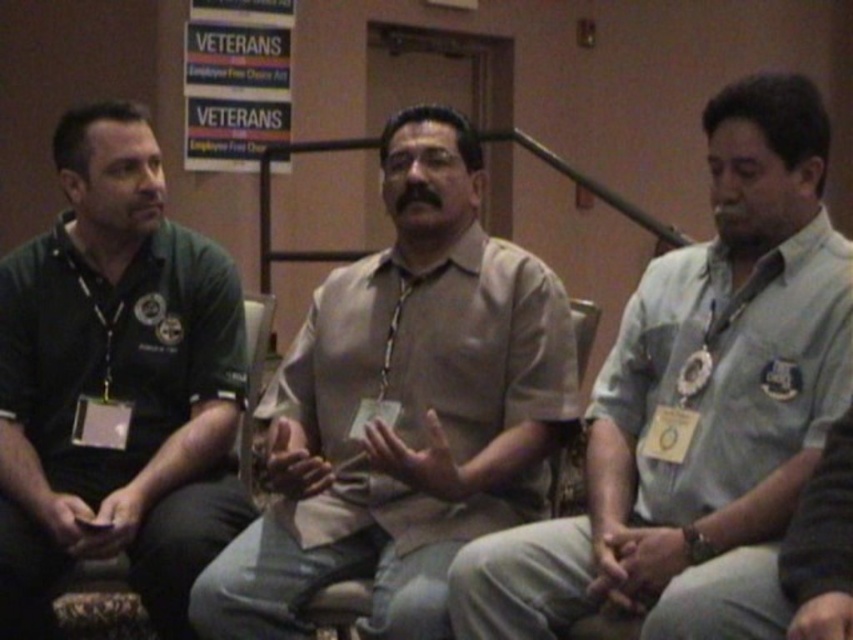
Which is above, dark green polo shirt at left or wooden chair at center?

Positioned higher is dark green polo shirt at left.

Which is more to the right, dark green polo shirt at left or wooden chair at center?

From the viewer's perspective, wooden chair at center appears more on the right side.

This screenshot has width=853, height=640. In order to click on dark green polo shirt at left in this screenshot , I will do `click(115, 381)`.

Does point (747, 140) come farther from viewer compared to point (250, 301)?

No, (747, 140) is closer to viewer.

Can you confirm if light gray shirt at center is bigger than wooden chair at center?

Indeed, light gray shirt at center has a larger size compared to wooden chair at center.

Which is in front, point (695, 390) or point (238, 476)?

Positioned in front is point (695, 390).

The height and width of the screenshot is (640, 853). I want to click on light gray shirt at center, so click(x=698, y=404).

Is beige fabric shirt at center to the right of wooden chair at center from the viewer's perspective?

Indeed, beige fabric shirt at center is positioned on the right side of wooden chair at center.

Which is in front, point (341, 458) or point (247, 392)?

Point (341, 458) is in front.

Find the location of `beige fabric shirt at center`. beige fabric shirt at center is located at coordinates (404, 406).